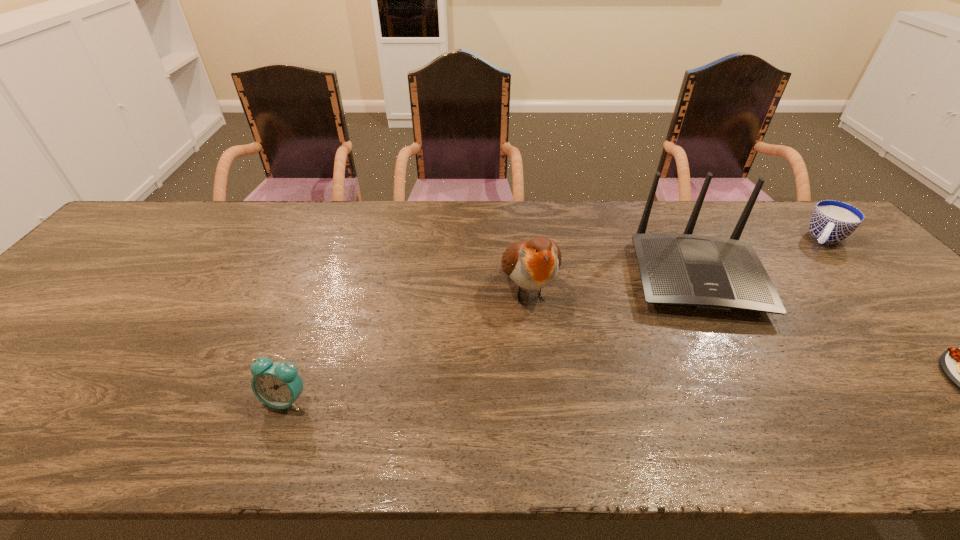
Where is `vacant area located 0.230m at the face of the bird`? vacant area located 0.230m at the face of the bird is located at coordinates (564, 409).

At what (x,y) coordinates should I click in order to perform the action: click on vacant space located 0.060m on the side of the fourth tallest object with the handle. Please return your answer as a coordinate pair (x, y). Looking at the image, I should click on (813, 258).

Identify the location of vacant space located on the side of the fourth tallest object with the handle. The width and height of the screenshot is (960, 540). (801, 280).

At what (x,y) coordinates should I click in order to perform the action: click on blank area located 0.160m on the side of the fourth tallest object with the handle. Please return your answer as a coordinate pair (x, y). The width and height of the screenshot is (960, 540). Looking at the image, I should click on coord(804,275).

Find the location of a particular element. router located at the far edge is located at coordinates (707, 273).

This screenshot has width=960, height=540. Find the location of `cup that is positioned at the far edge`. cup that is positioned at the far edge is located at coordinates (832, 221).

Where is `object that is at the near edge`? Image resolution: width=960 pixels, height=540 pixels. object that is at the near edge is located at coordinates (278, 385).

Identify the location of object present at the right edge. This screenshot has width=960, height=540. (832, 221).

The image size is (960, 540). What are the coordinates of `object present at the far right corner` in the screenshot? It's located at [832, 221].

In the image, there is a desktop. At what (x,y) coordinates should I click in order to perform the action: click on vacant space at the far edge. Please return your answer as a coordinate pair (x, y). Looking at the image, I should click on (399, 225).